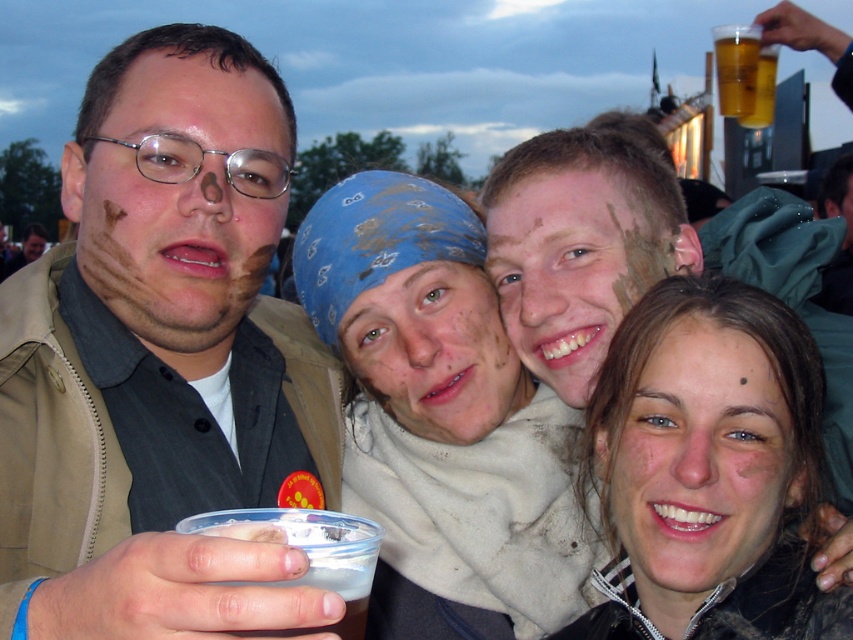
Question: Is matte black jacket at lower right smaller than matte skin face at center?

Choices:
 (A) yes
 (B) no

Answer: (B)

Question: Among these objects, which one is nearest to the camera?

Choices:
 (A) matte white jacket at center
 (B) matte brown face paint at center
 (C) matte skin face at lower right

Answer: (B)

Question: Which point is closer to the camera taking this photo?

Choices:
 (A) (631, 273)
 (B) (155, 282)

Answer: (B)

Question: Does matte skin face at lower right appear on the left side of clear plastic cup at lower left?

Choices:
 (A) yes
 (B) no

Answer: (B)

Question: Is matte brown face at left closer to camera compared to matte skin face at lower right?

Choices:
 (A) no
 (B) yes

Answer: (A)

Question: Which point appears farthest from the camera in this image?

Choices:
 (A) (386, 394)
 (B) (184, 390)
 (C) (223, 317)

Answer: (A)